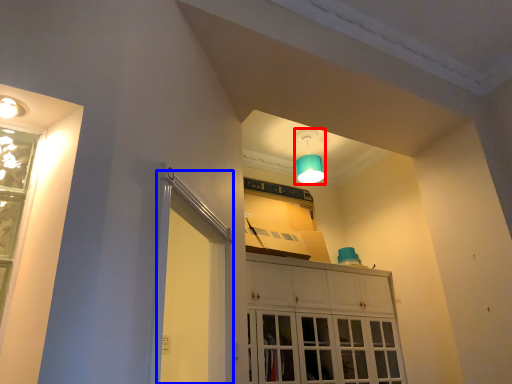
Question: Which of the following is the farthest to the observer, lamp (highlighted by a red box) or screen door (highlighted by a blue box)?

Choices:
 (A) lamp
 (B) screen door

Answer: (A)